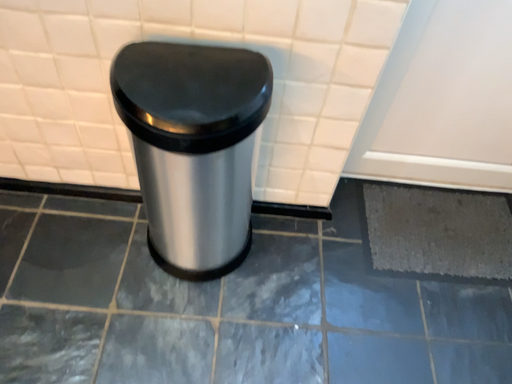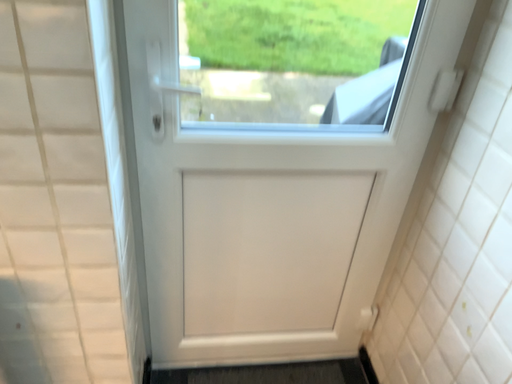
Question: Which way did the camera rotate in the video?

Choices:
 (A) rotated upward
 (B) rotated downward

Answer: (A)